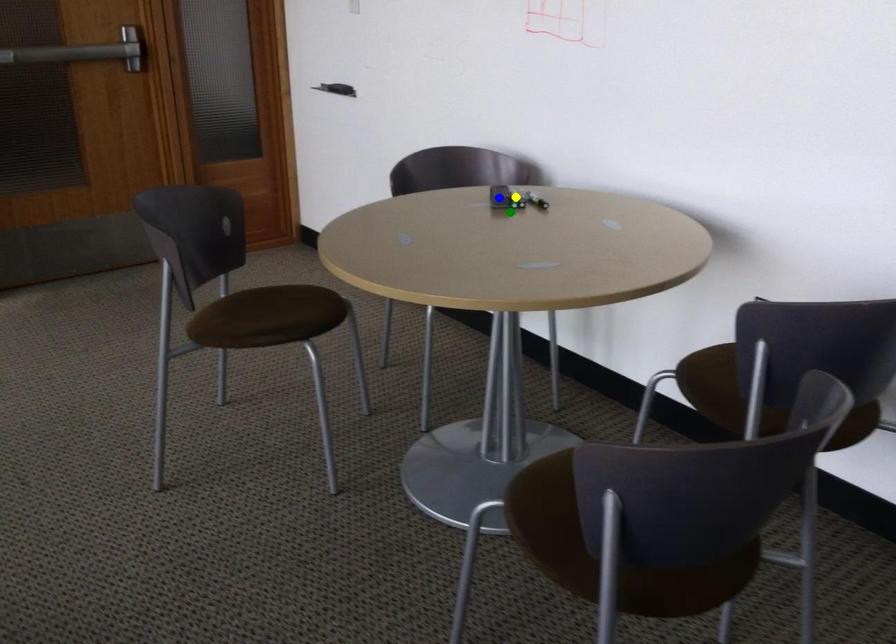
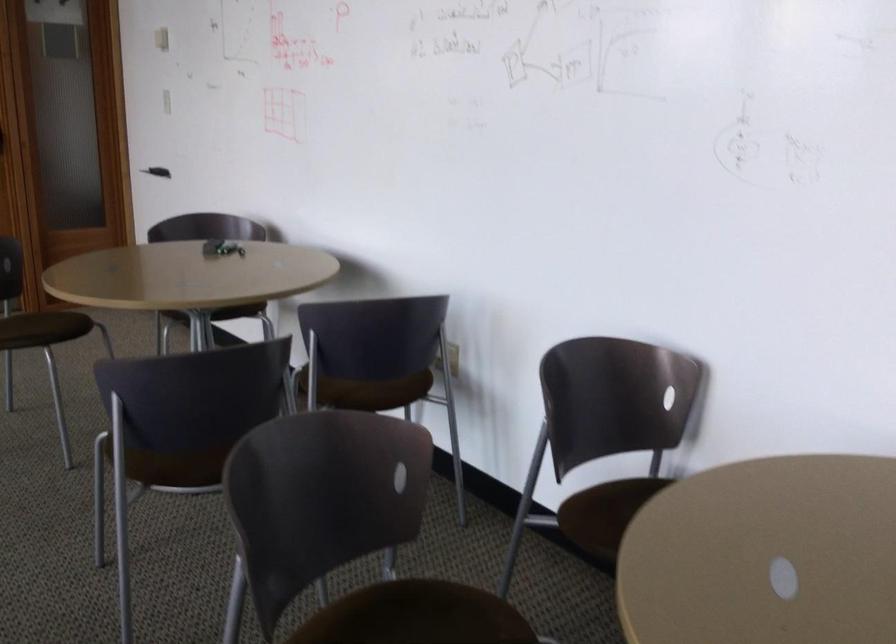
I am providing you with two images of the same scene from different viewpoints. Three points are marked in image1. Which point corresponds to a part or object that is occluded in image2?In image1, three points are marked. Which of them correspond to a part or object that is occluded in image2?Among the three points shown in image1, which one corresponds to a part or object that is no longer visible due to occlusion in image2?

blue point, yellow point cannot be seen in image2.